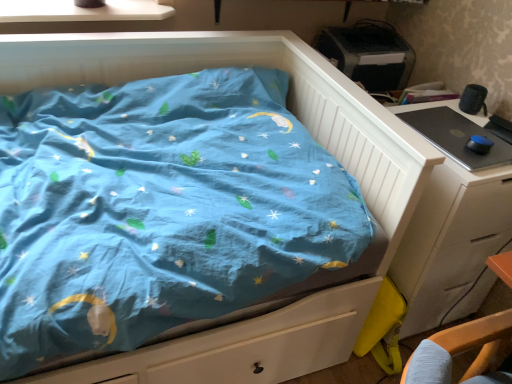
Question: From a real-world perspective, is black glossy desktop at right on white wood chest of drawers at right?

Choices:
 (A) yes
 (B) no

Answer: (A)

Question: Is the position of black glossy desktop at right more distant than that of white wood chest of drawers at right?

Choices:
 (A) yes
 (B) no

Answer: (A)

Question: Is black glossy desktop at right placed right next to white wood chest of drawers at right?

Choices:
 (A) no
 (B) yes

Answer: (A)

Question: Can you confirm if black glossy desktop at right is thinner than white wood chest of drawers at right?

Choices:
 (A) yes
 (B) no

Answer: (A)

Question: Is black glossy desktop at right looking in the opposite direction of white wood chest of drawers at right?

Choices:
 (A) yes
 (B) no

Answer: (B)

Question: Considering the relative sizes of black glossy desktop at right and white wood chest of drawers at right in the image provided, is black glossy desktop at right taller than white wood chest of drawers at right?

Choices:
 (A) yes
 (B) no

Answer: (B)

Question: Considering the relative sizes of white wood chest of drawers at right and white glossy window sill at upper left in the image provided, is white wood chest of drawers at right thinner than white glossy window sill at upper left?

Choices:
 (A) no
 (B) yes

Answer: (A)

Question: Is white wood chest of drawers at right located outside white glossy window sill at upper left?

Choices:
 (A) yes
 (B) no

Answer: (A)

Question: Could white glossy window sill at upper left be considered to be inside white wood chest of drawers at right?

Choices:
 (A) yes
 (B) no

Answer: (B)

Question: Is the depth of white wood chest of drawers at right greater than that of white glossy window sill at upper left?

Choices:
 (A) no
 (B) yes

Answer: (A)

Question: From the image's perspective, is white wood chest of drawers at right located above white glossy window sill at upper left?

Choices:
 (A) no
 (B) yes

Answer: (A)

Question: Does white wood chest of drawers at right have a greater height compared to white glossy window sill at upper left?

Choices:
 (A) yes
 (B) no

Answer: (A)

Question: Is white glossy window sill at upper left shorter than black glossy desktop at right?

Choices:
 (A) yes
 (B) no

Answer: (B)